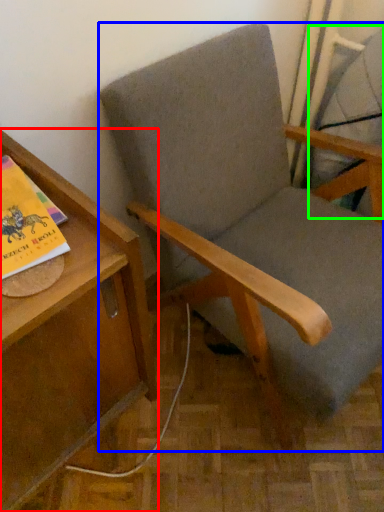
Question: Estimate the real-world distances between objects in this image. Which object is closer to table (highlighted by a red box), chair (highlighted by a blue box) or swivel chair (highlighted by a green box)?

Choices:
 (A) chair
 (B) swivel chair

Answer: (A)